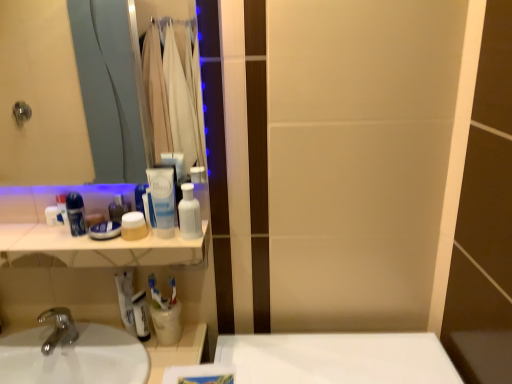
The image size is (512, 384). Identify the location of vacant space in between silver metallic faucet at lower left and white matte toothpaste at lower left. (99, 340).